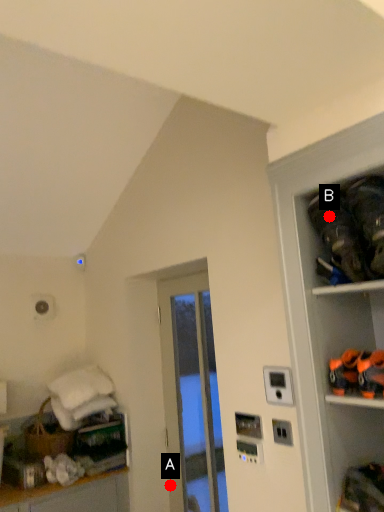
Question: Two points are circled on the image, labeled by A and B beside each circle. Which point appears farthest from the camera in this image?

Choices:
 (A) A is further
 (B) B is further

Answer: (A)